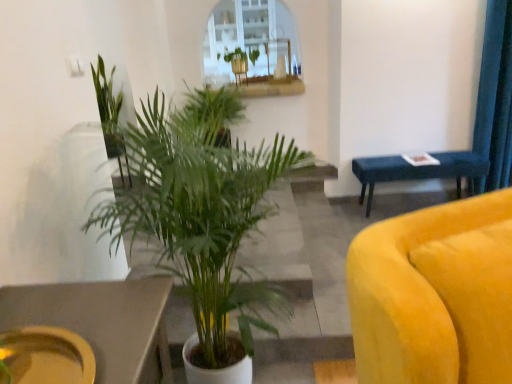
Question: From the image's perspective, is green leafy plant at center, which is the 3th houseplant from back to front, positioned above or below blue fabric bench at right?

Choices:
 (A) below
 (B) above

Answer: (B)

Question: In the image, is green leafy plant at center, which appears as the 2th houseplant when viewed from the front, on the left side or the right side of blue fabric bench at right?

Choices:
 (A) right
 (B) left

Answer: (B)

Question: Based on their relative distances, which object is farther from the green leafy plant at upper center, which appears as the fourth houseplant when viewed from the front?

Choices:
 (A) matte yellow platter at lower left
 (B) green leafy plant at center, which is the 3th houseplant from back to front
 (C) green leafy plant at center, positioned as the fourth houseplant in back-to-front order
 (D) green leafy plant at upper left, the second houseplant from the back
 (E) blue fabric bench at right

Answer: (A)

Question: Estimate the real-world distances between objects in this image. Which object is closer to the green leafy plant at upper left, which ranks as the third houseplant in front-to-back order?

Choices:
 (A) matte yellow platter at lower left
 (B) green leafy plant at upper center, which ranks as the 1th houseplant in back-to-front order
 (C) blue fabric bench at right
 (D) green leafy plant at center, which appears as the 2th houseplant when viewed from the front
 (E) green leafy plant at center, positioned as the fourth houseplant in back-to-front order

Answer: (E)